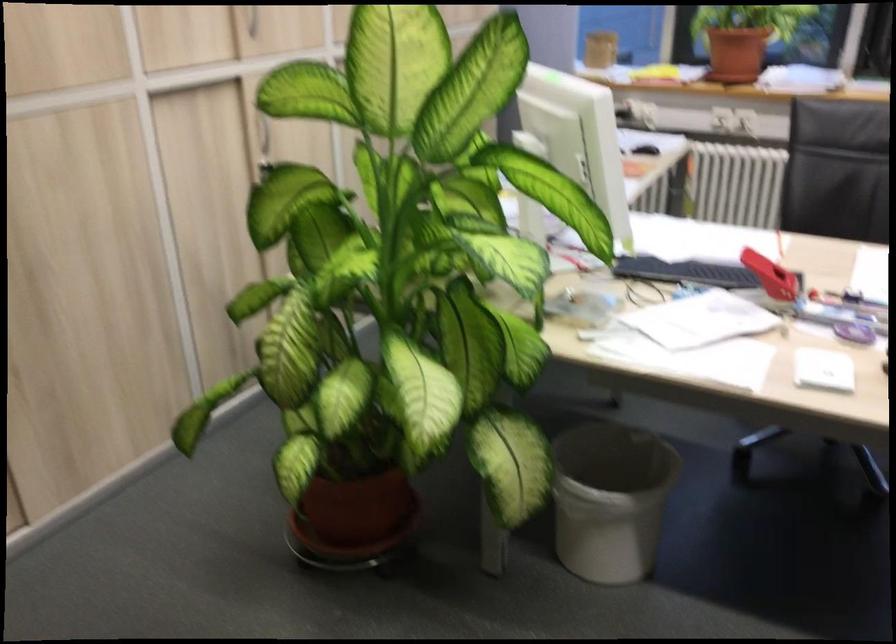
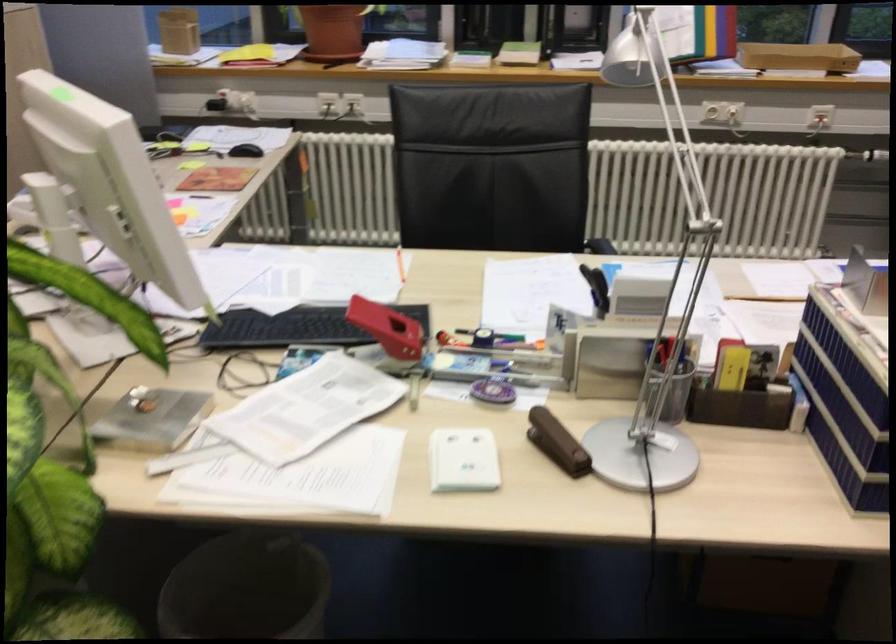
Where in the second image is the point corresponding to (822,371) from the first image?

(462, 460)